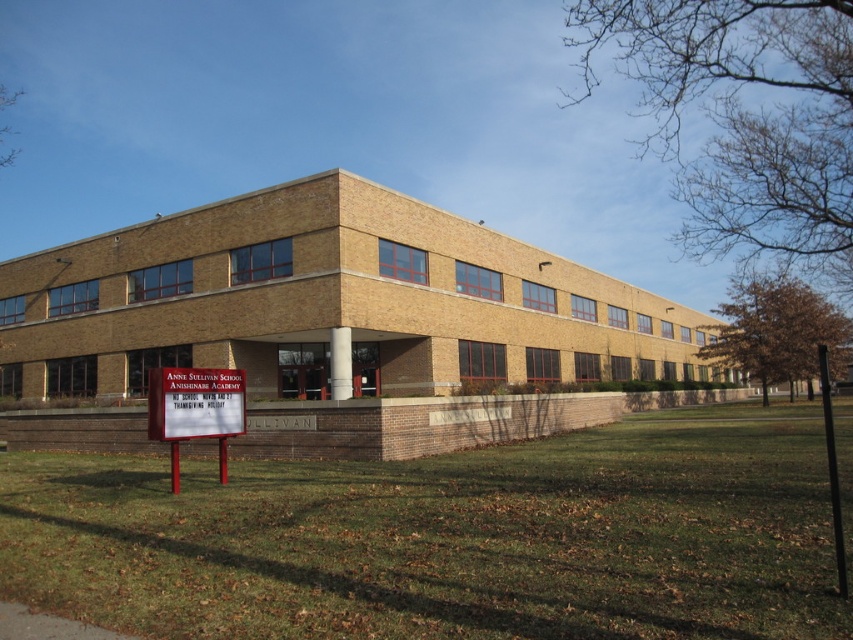
Question: Which point is farther from the camera taking this photo?

Choices:
 (A) (213, 420)
 (B) (204, 288)
 (C) (173, 368)

Answer: (B)

Question: Which of the following is the farthest from the observer?

Choices:
 (A) white plastic sign at lower left
 (B) brown brick building at center
 (C) red plastic sign at lower left

Answer: (B)

Question: Does white plastic sign at lower left have a larger size compared to red plastic sign at lower left?

Choices:
 (A) no
 (B) yes

Answer: (A)

Question: Can you confirm if brown brick building at center is positioned to the right of red plastic sign at lower left?

Choices:
 (A) no
 (B) yes

Answer: (B)

Question: Does brown brick building at center have a lesser width compared to red plastic sign at lower left?

Choices:
 (A) no
 (B) yes

Answer: (A)

Question: Which object is farther from the camera taking this photo?

Choices:
 (A) brown brick building at center
 (B) red plastic sign at lower left

Answer: (A)